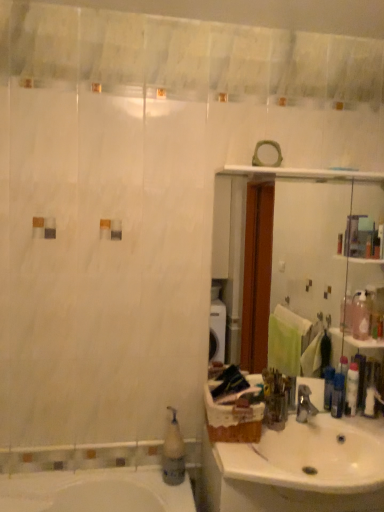
Question: Should I look upward or downward to see white ceramic sink at lower right?

Choices:
 (A) up
 (B) down

Answer: (B)

Question: Is blue plastic bottle at sink wider than white plastic soap dispenser at lower left?

Choices:
 (A) no
 (B) yes

Answer: (A)

Question: Is white plastic soap dispenser at lower left at the back of blue plastic bottle at sink?

Choices:
 (A) no
 (B) yes

Answer: (A)

Question: Is blue plastic bottle at sink outside white plastic soap dispenser at lower left?

Choices:
 (A) yes
 (B) no

Answer: (A)

Question: From a real-world perspective, is blue plastic bottle at sink physically below white plastic soap dispenser at lower left?

Choices:
 (A) no
 (B) yes

Answer: (A)

Question: From a real-world perspective, is blue plastic bottle at sink on white plastic soap dispenser at lower left?

Choices:
 (A) no
 (B) yes

Answer: (B)

Question: Is blue plastic bottle at sink taller than white plastic soap dispenser at lower left?

Choices:
 (A) no
 (B) yes

Answer: (A)

Question: From the image's perspective, is clear glass mirror at upper center beneath blue plastic bottle at sink?

Choices:
 (A) yes
 (B) no

Answer: (B)

Question: From a real-world perspective, is clear glass mirror at upper center positioned over blue plastic bottle at sink based on gravity?

Choices:
 (A) yes
 (B) no

Answer: (A)

Question: Can you confirm if clear glass mirror at upper center is positioned to the right of blue plastic bottle at sink?

Choices:
 (A) yes
 (B) no

Answer: (B)

Question: Could you tell me if clear glass mirror at upper center is facing blue plastic bottle at sink?

Choices:
 (A) yes
 (B) no

Answer: (A)

Question: Is clear glass mirror at upper center next to blue plastic bottle at sink and touching it?

Choices:
 (A) yes
 (B) no

Answer: (B)

Question: Is clear glass mirror at upper center further to the viewer compared to blue plastic bottle at sink?

Choices:
 (A) yes
 (B) no

Answer: (B)

Question: Are white plastic soap dispenser at lower left and white ceramic sink at lower right beside each other?

Choices:
 (A) yes
 (B) no

Answer: (B)